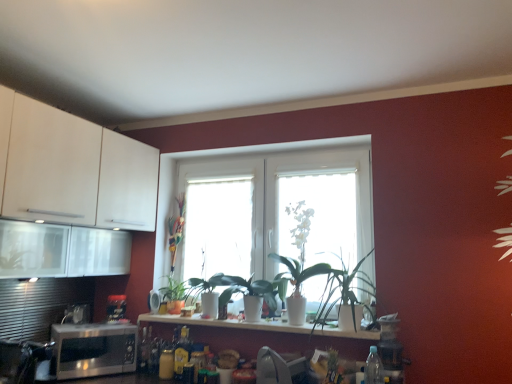
Question: Is white glossy countertop at center wider than white glossy vase at center, the second plant viewed from the right?

Choices:
 (A) yes
 (B) no

Answer: (A)

Question: Is white glossy countertop at center positioned with its back to white glossy vase at center, which is the fourth plant in left-to-right order?

Choices:
 (A) yes
 (B) no

Answer: (B)

Question: Is white glossy countertop at center at the right side of white glossy vase at center, which is the fourth plant in left-to-right order?

Choices:
 (A) no
 (B) yes

Answer: (A)

Question: Does white glossy countertop at center have a larger size compared to white glossy vase at center, which is the fourth plant in left-to-right order?

Choices:
 (A) yes
 (B) no

Answer: (B)

Question: Is white glossy countertop at center positioned behind white glossy vase at center, the second plant viewed from the right?

Choices:
 (A) yes
 (B) no

Answer: (B)

Question: Based on their sizes in the image, would you say transparent glass window at center, which is the third window in right-to-left order, is bigger or smaller than white glossy vase at center, the 3th window in the left-to-right sequence?

Choices:
 (A) big
 (B) small

Answer: (A)

Question: Relative to white glossy vase at center, which ranks as the 1th window in right-to-left order, is transparent glass window at center, which is the third window in right-to-left order, in front or behind?

Choices:
 (A) behind
 (B) front

Answer: (A)

Question: Looking at their shapes, would you say transparent glass window at center, which is the third window in right-to-left order, is wider or thinner than white glossy vase at center, the 3th window in the left-to-right sequence?

Choices:
 (A) wide
 (B) thin

Answer: (A)

Question: In terms of height, does transparent glass window at center, which is counted as the 1th window, starting from the left, look taller or shorter compared to white glossy vase at center, which ranks as the 1th window in right-to-left order?

Choices:
 (A) tall
 (B) short

Answer: (A)

Question: Does point (x=245, y=205) appear closer or farther from the camera than point (x=114, y=309)?

Choices:
 (A) farther
 (B) closer

Answer: (A)

Question: Considering the positions of white glossy window at center, which is the 2th window in right-to-left order, and metallic black toaster at lower left, the 1th appliance from the right, in the image, is white glossy window at center, which is the 2th window in right-to-left order, taller or shorter than metallic black toaster at lower left, the 1th appliance from the right,?

Choices:
 (A) short
 (B) tall

Answer: (B)

Question: Based on their sizes in the image, would you say white glossy window at center, the 2th window positioned from the left, is bigger or smaller than metallic black toaster at lower left, the 2th appliance positioned from the left?

Choices:
 (A) big
 (B) small

Answer: (A)

Question: Considering the positions of white glossy window at center, the 2th window positioned from the left, and metallic black toaster at lower left, the 2th appliance positioned from the left, in the image, is white glossy window at center, the 2th window positioned from the left, wider or thinner than metallic black toaster at lower left, the 2th appliance positioned from the left,?

Choices:
 (A) wide
 (B) thin

Answer: (B)

Question: From the image's perspective, is white glossy vase at center, the 3th window in the left-to-right sequence, located above or below multicolored plastic plant at center, which is the fifth plant in right-to-left order?

Choices:
 (A) below
 (B) above

Answer: (B)

Question: Is white glossy vase at center, which ranks as the 1th window in right-to-left order, in front of or behind multicolored plastic plant at center, which appears as the 1th plant when viewed from the left, in the image?

Choices:
 (A) front
 (B) behind

Answer: (A)